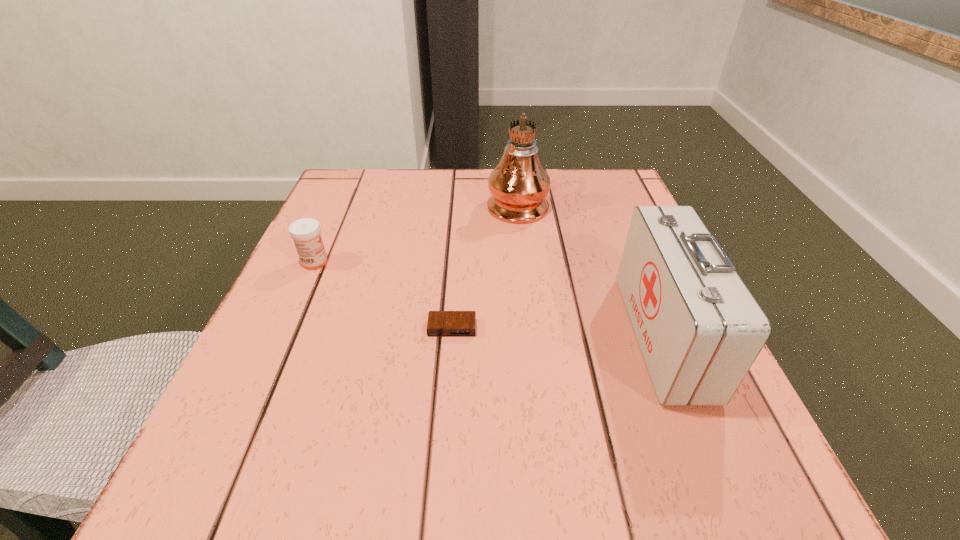
You are a GUI agent. You are given a task and a screenshot of the screen. Output one action in this format:
    pyautogui.click(x=<x>, y=<y>)
    Task: Click on the free location located 0.260m on the front-facing side of the rightmost object
    The width and height of the screenshot is (960, 540).
    Given the screenshot: What is the action you would take?
    pyautogui.click(x=482, y=335)

At what (x,y) coordinates should I click in order to perform the action: click on vacant point located 0.310m on the front-facing side of the rightmost object. Please return your answer as a coordinate pair (x, y). This screenshot has height=540, width=960. Looking at the image, I should click on (452, 335).

Where is `vacant space located 0.180m on the back of the medicine`? The height and width of the screenshot is (540, 960). vacant space located 0.180m on the back of the medicine is located at coordinates (339, 207).

Locate an element on the screen. vacant point located 0.170m on the front face of the alarm clock is located at coordinates (445, 429).

Find the location of a particular element. object that is at the far edge is located at coordinates (519, 184).

Locate an element on the screen. The width and height of the screenshot is (960, 540). object that is positioned at the left edge is located at coordinates (305, 232).

Find the location of `object that is positioned at the right edge`. object that is positioned at the right edge is located at coordinates (699, 328).

This screenshot has width=960, height=540. Identify the location of vacant space at the far edge of the desktop. (461, 208).

You are a GUI agent. You are given a task and a screenshot of the screen. Output one action in this format:
    pyautogui.click(x=<x>, y=<y>)
    Task: Click on the free space at the near edge
    
    Given the screenshot: What is the action you would take?
    (457, 451)

Where is `blank area at the left edge`? The width and height of the screenshot is (960, 540). blank area at the left edge is located at coordinates pos(253,353).